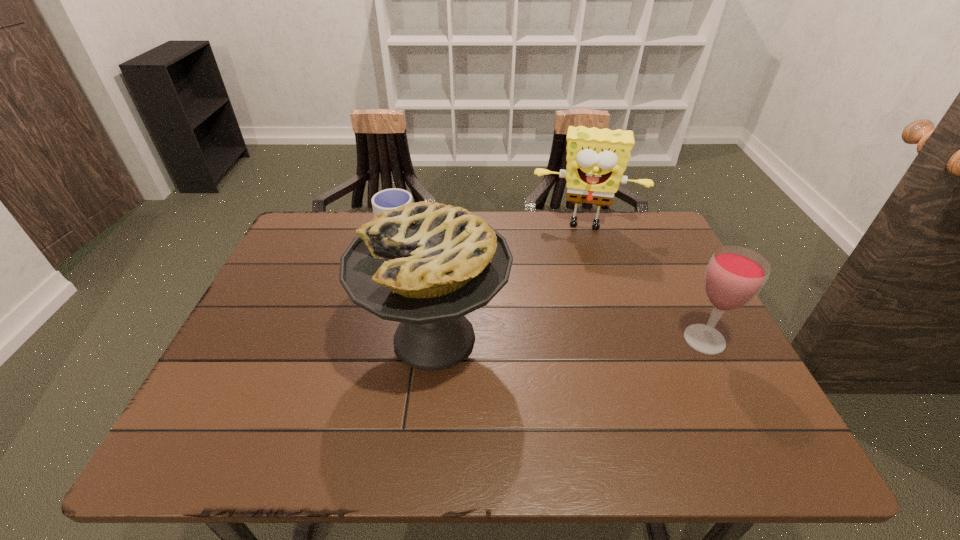
At what (x,y) coordinates should I click in order to perform the action: click on empty space between the sponge and the pie. Please return your answer as a coordinate pair (x, y). Looking at the image, I should click on (510, 281).

Where is `free spot between the pie and the sponge`? Image resolution: width=960 pixels, height=540 pixels. free spot between the pie and the sponge is located at coordinates (510, 281).

What are the coordinates of `free point between the pie and the wineglass` in the screenshot? It's located at (569, 339).

You are a GUI agent. You are given a task and a screenshot of the screen. Output one action in this format:
    pyautogui.click(x=<x>, y=<y>)
    Task: Click on the free spot between the second shortest object and the cup
    This screenshot has height=540, width=960.
    Given the screenshot: What is the action you would take?
    pyautogui.click(x=553, y=289)

I want to click on free space between the pie and the wineglass, so click(569, 339).

I want to click on free space between the wineglass and the sponge, so click(x=645, y=282).

The width and height of the screenshot is (960, 540). I want to click on vacant area between the sponge and the second shortest object, so click(x=645, y=282).

Identify the location of object that stands as the closest to the pie. (387, 199).

Identify which object is located as the second nearest to the pie. Please provide its 2D coordinates. Your answer should be formatted as a tuple, i.e. [(x, y)], where the tuple contains the x and y coordinates of a point satisfying the conditions above.

[(596, 158)]

Identify the location of blank space that satisfies the following two spatial constraints: 1. on the back side of the shortest object; 2. on the left side of the sponge. pos(404,225).